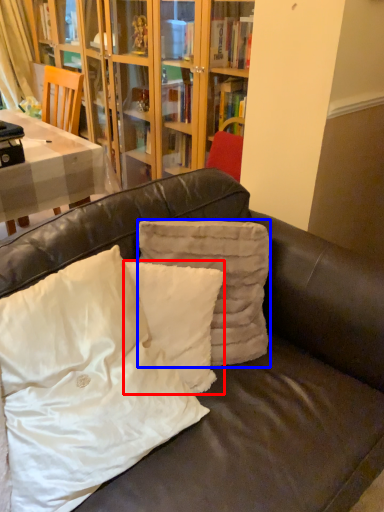
Question: Which object is closer to the camera taking this photo, pillow (highlighted by a red box) or pillow (highlighted by a blue box)?

Choices:
 (A) pillow
 (B) pillow

Answer: (A)